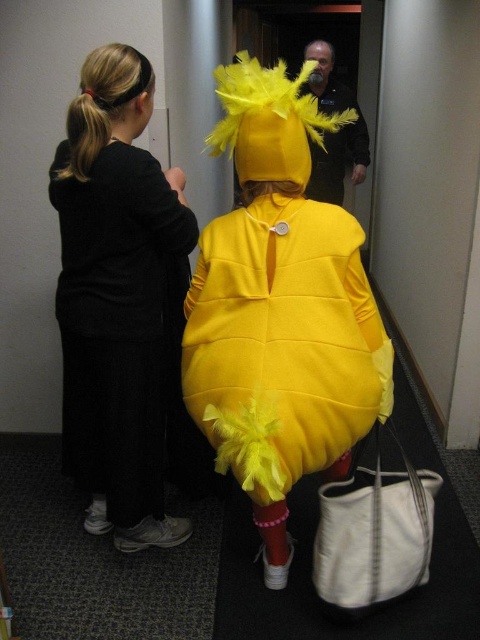
Question: Which point appears farthest from the camera in this image?

Choices:
 (A) (94, 124)
 (B) (277, 234)

Answer: (A)

Question: Can you confirm if black fabric dress at left is smaller than matte yellow costume at center?

Choices:
 (A) yes
 (B) no

Answer: (B)

Question: Is black fabric dress at left to the left of matte yellow costume at center from the viewer's perspective?

Choices:
 (A) no
 (B) yes

Answer: (B)

Question: Among these objects, which one is nearest to the camera?

Choices:
 (A) black fabric dress at left
 (B) matte yellow costume at center

Answer: (B)

Question: Does black fabric dress at left lie behind matte yellow costume at center?

Choices:
 (A) yes
 (B) no

Answer: (A)